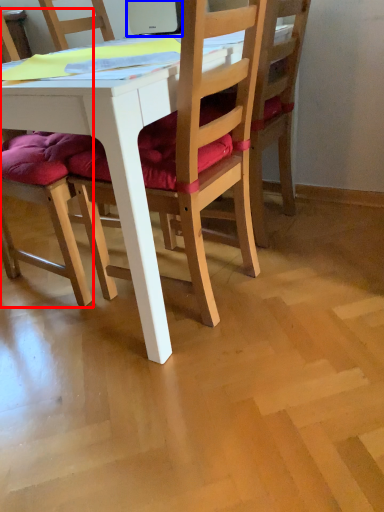
Question: Which point is closer to the camera, chair (highlighted by a red box) or laptop (highlighted by a blue box)?

Choices:
 (A) chair
 (B) laptop

Answer: (A)